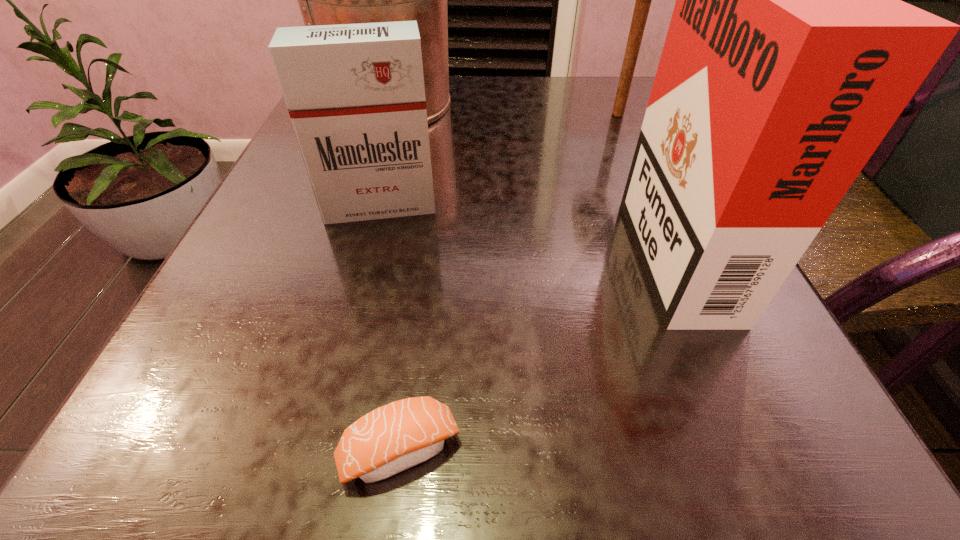
This screenshot has width=960, height=540. What are the coordinates of `the tallest object` in the screenshot? It's located at (323, 0).

Locate an element on the screen. The width and height of the screenshot is (960, 540). mallet is located at coordinates (643, 0).

Locate an element on the screen. the taller cigarette case is located at coordinates click(x=789, y=56).

Identify the location of the shorter cigarette case. (355, 93).

Identify the location of the left cigarette case. (355, 93).

What are the coordinates of `sushi` in the screenshot? It's located at (395, 437).

Locate an element on the screen. This screenshot has height=540, width=960. the shortest object is located at coordinates (395, 437).

This screenshot has height=540, width=960. I want to click on free space located 0.290m on the right of the tallest object, so (x=595, y=104).

Locate an element on the screen. This screenshot has width=960, height=540. vacant region located on the striking face of the mallet is located at coordinates (655, 193).

The width and height of the screenshot is (960, 540). Find the location of `free space located 0.080m on the front-facing side of the taller cigarette case`. free space located 0.080m on the front-facing side of the taller cigarette case is located at coordinates (579, 243).